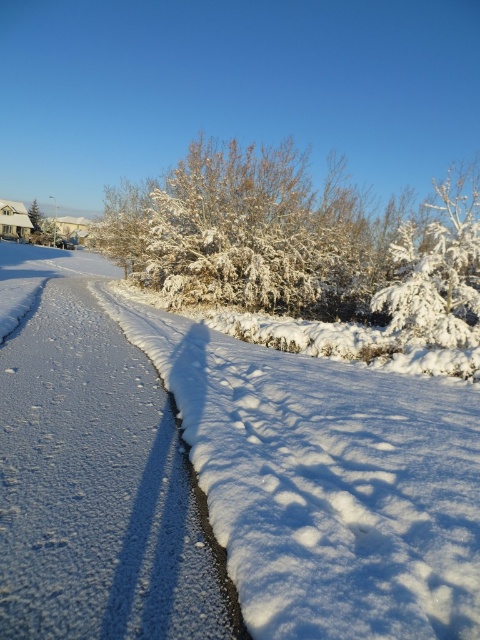
Does white frosty bush at upper right appear on the right side of green matte evergreen tree at upper left?

Correct, you'll find white frosty bush at upper right to the right of green matte evergreen tree at upper left.

Is white frosty bush at upper right wider than green matte evergreen tree at upper left?

Yes, white frosty bush at upper right is wider than green matte evergreen tree at upper left.

Locate an element on the screen. This screenshot has height=640, width=480. white frosty bush at upper right is located at coordinates (439, 268).

Who is positioned more to the left, white fluffy snow at center or white snow at center?

From the viewer's perspective, white snow at center appears more on the left side.

Can you confirm if white fluffy snow at center is taller than white snow at center?

No.

Which is behind, point (444, 500) or point (68, 449)?

The point (68, 449) is more distant.

What are the coordinates of `white fluffy snow at center` in the screenshot? It's located at (325, 483).

Is point (352, 237) closer to viewer compared to point (36, 211)?

That is True.

Image resolution: width=480 pixels, height=640 pixels. I want to click on white frosty bush at upper center, so click(x=301, y=243).

Find the location of a particular element. Image resolution: width=480 pixels, height=640 pixels. white frosty bush at upper center is located at coordinates [301, 243].